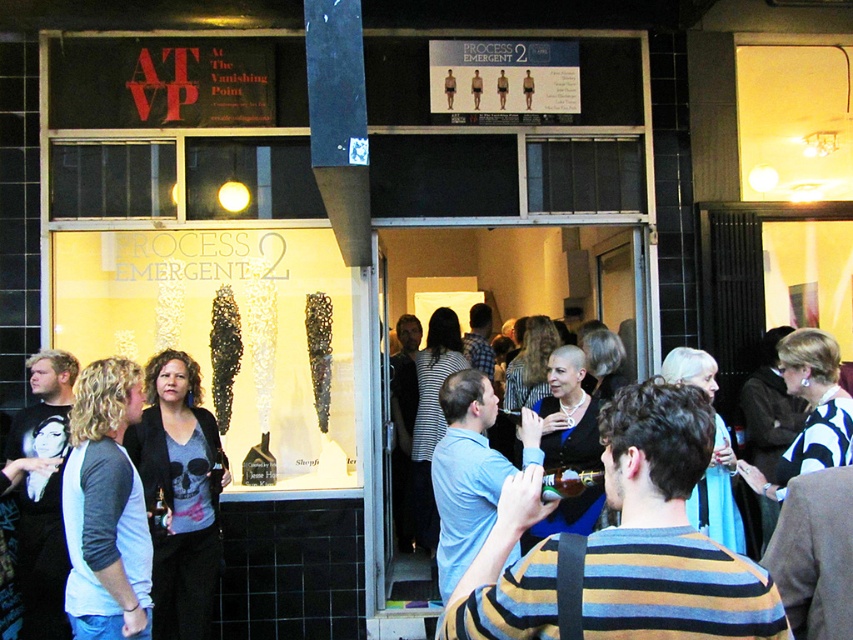
You are standing in front of the gallery entrance and see both the striped sweater at center and the matte black jacket at center. Which clothing item is nearer to you?

The striped sweater at center is closer to the viewer than the matte black jacket at center, so the striped sweater at center is nearer to you.

You are a photographer trying to capture both the striped sweater at center and the matte black jacket at center in the same frame. Given their sizes, which one will you need to position closer to the camera to ensure both fit in the frame?

The striped sweater at center occupies less space than the matte black jacket at center, so you should position the matte black jacket at center closer to the camera to ensure both fit in the frame.